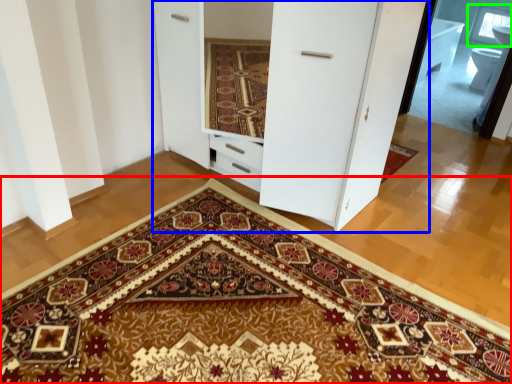
Question: Estimate the real-world distances between objects in this image. Which object is farther from doormat (highlighted by a red box), dresser (highlighted by a blue box) or window (highlighted by a green box)?

Choices:
 (A) dresser
 (B) window

Answer: (B)